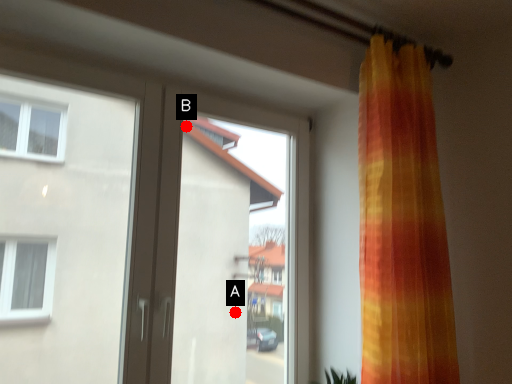
Question: Two points are circled on the image, labeled by A and B beside each circle. Which point is closer to the camera?

Choices:
 (A) A is closer
 (B) B is closer

Answer: (A)